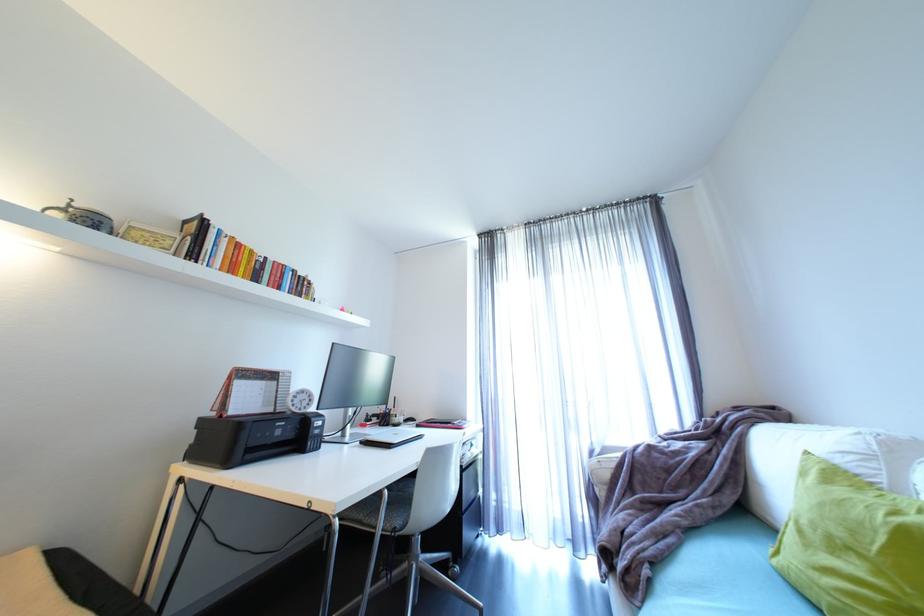
Find the location of a particular element. This screenshot has height=616, width=924. sofa sitting surface is located at coordinates (719, 572).